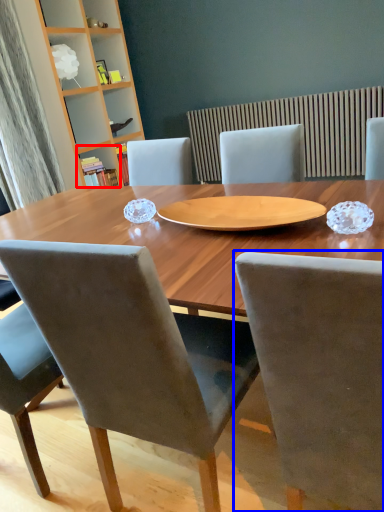
Question: Which of the following is the farthest to the observer, shelf (highlighted by a red box) or chair (highlighted by a blue box)?

Choices:
 (A) shelf
 (B) chair

Answer: (A)